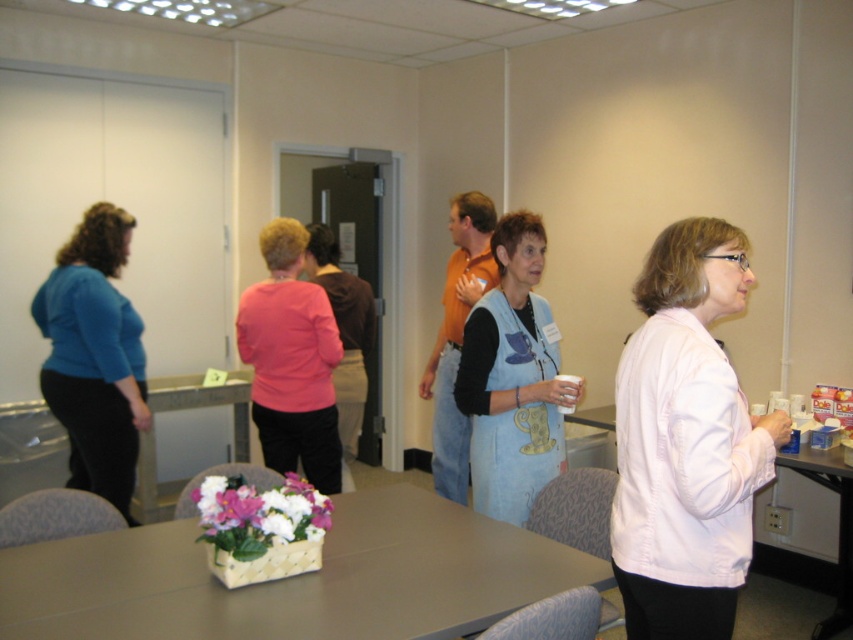
You are organizing a meeting in this room and need to place a 5 feet long banner between the light blue denim vest at center and the blue matte shirt at left. Is there enough space between them to fit the banner?

The distance between the light blue denim vest at center and the blue matte shirt at left is 4.90 feet. Since the banner is 5 feet long, it is slightly longer than the available space, so the banner will not fit between them.

You are organizing a meeting in the room. You need to place a name tag on the table. Where should you place it so that it is to the right of the light blue denim vest at center but still on the smooth plastic table at lower right?

Place the name tag to the right side of the light blue denim vest at center on the smooth plastic table at lower right, since the light blue denim vest at center is already on the left side of the smooth plastic table at lower right.